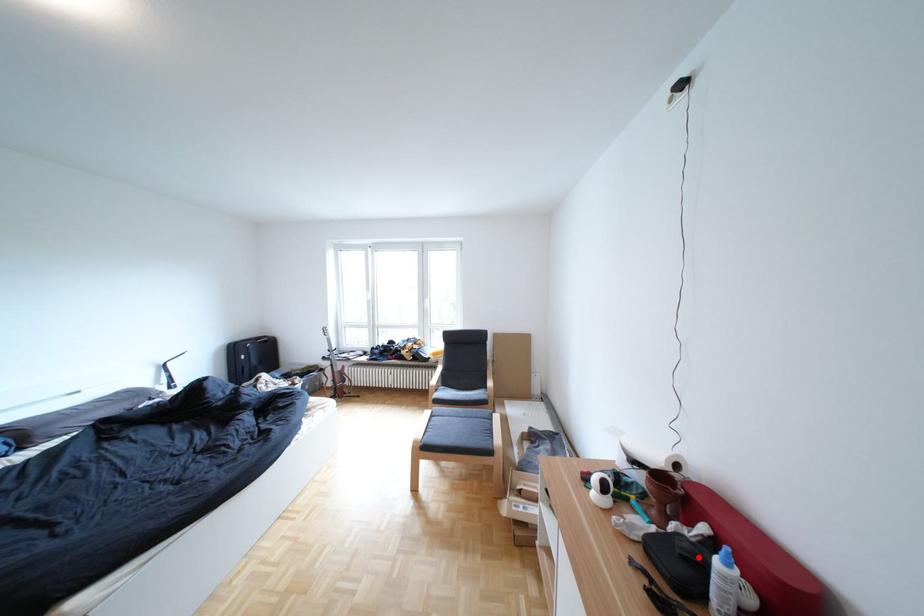
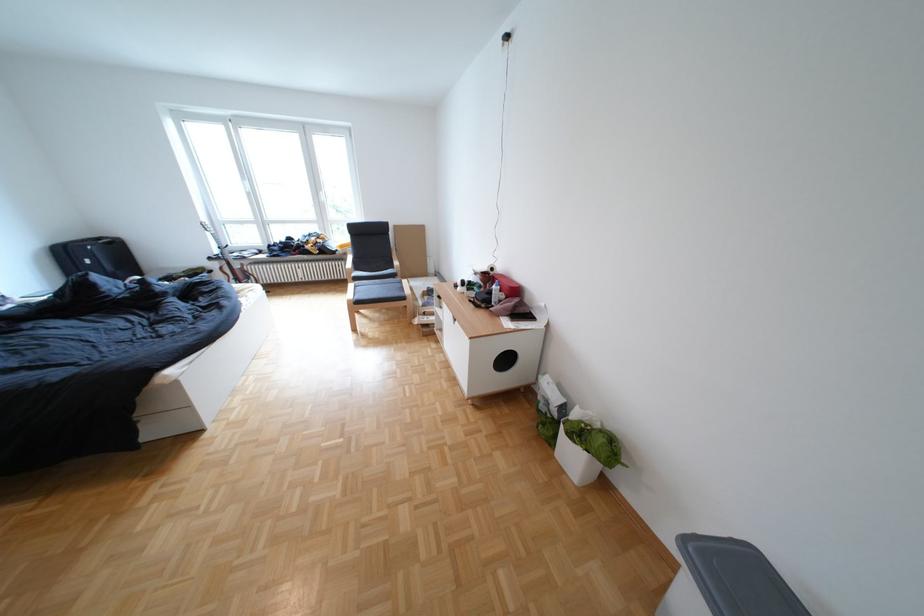
Locate, in the second image, the point that corresponds to the highlighted location in the first image.

(503, 294)